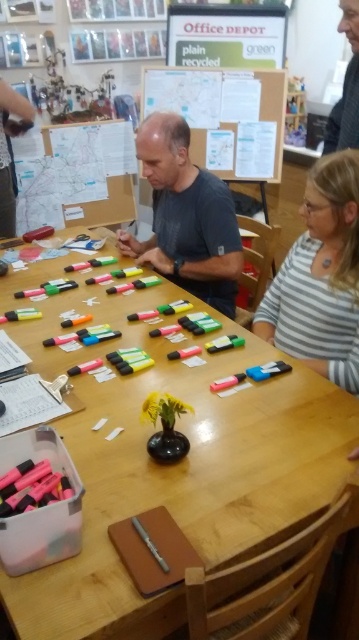
You are a person who is 1.7 meters tall. You are standing in front of the wooden table at center and the dark gray shirt at center. Which object is taller than your height?

The wooden table at center has a greater height compared to dark gray shirt at center, but neither of them is taller than your 1.7 meters height.

You are organizing a presentation and need to place both the white paperboard at upper center and the matte black shirt at upper right on a shelf. Which object should you place first if you want to maximize shelf space?

The white paperboard at upper center should be placed first since it is smaller than the matte black shirt at upper right, allowing more space for the larger item afterward.